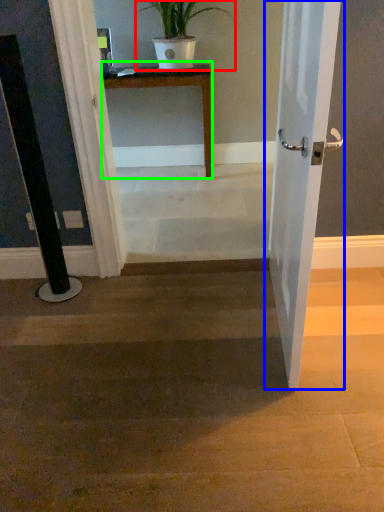
Question: Considering the real-world distances, which object is farthest from houseplant (highlighted by a red box)? door (highlighted by a blue box) or table (highlighted by a green box)?

Choices:
 (A) door
 (B) table

Answer: (A)